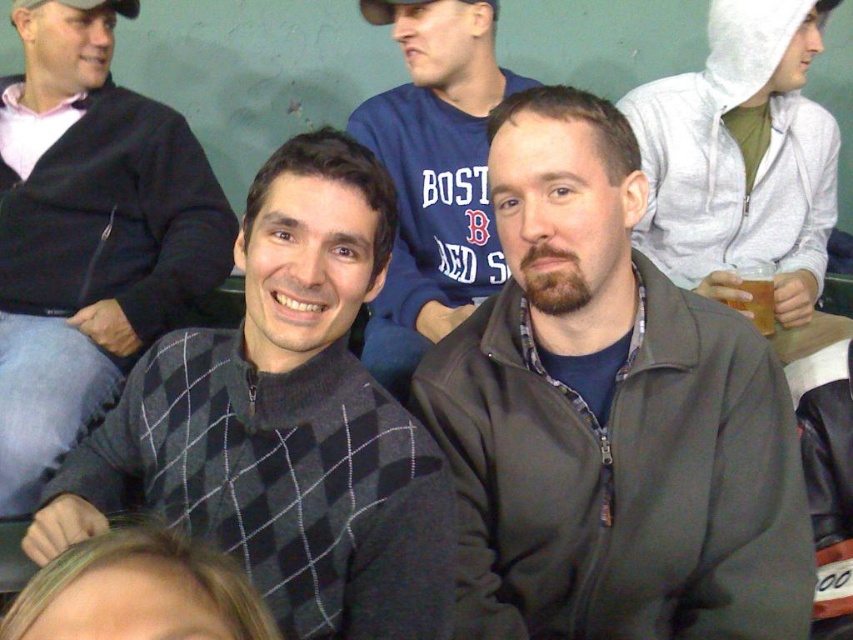
You are a photographer trying to capture a clear shot of both the dark gray argyle sweater at center and the dark gray sweater at center. Since the camera has a limited focus range, you need to adjust your position to ensure both are in focus. Based on their sizes, which sweater should you focus on first to maximize the chances of both being in focus?

The dark gray argyle sweater at center is larger in size than the dark gray sweater at center. To maximize the chances of both being in focus, you should focus on the larger dark gray argyle sweater at center first, as it requires more precise focus due to its size.

You are a photographer trying to capture a closeup of both the dark gray argyle sweater at center and the dark gray sweater at center. Given that your camera lens has a maximum focus range of 50 centimeters, will you be able to capture both in focus without adjusting your position?

A: The dark gray argyle sweater at center and dark gray sweater at center are 57.22 centimeters apart from each other, which exceeds the camera lens maximum focus range of 50 centimeters. Therefore, you will need to adjust your position to ensure both are within the focus range.